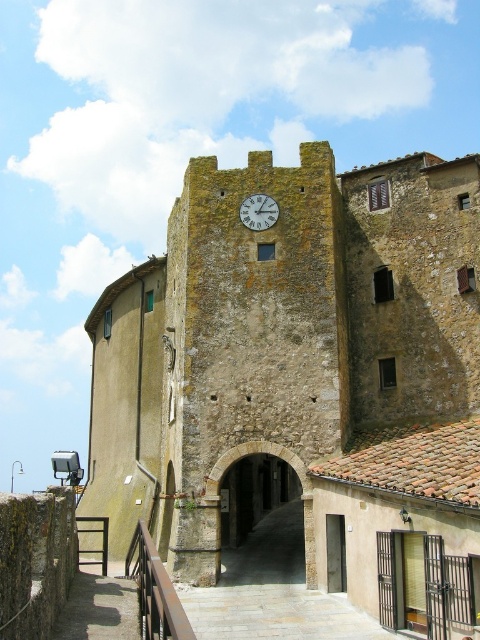
Does brown stone clock tower at center have a larger size compared to green stone clock at center?

Yes, brown stone clock tower at center is bigger than green stone clock at center.

Describe the element at coordinates (303, 380) in the screenshot. The height and width of the screenshot is (640, 480). I see `brown stone clock tower at center` at that location.

Is point (275, 179) positioned behind point (245, 218)?

Yes, it is.

At what (x,y) coordinates should I click in order to perform the action: click on brown stone clock tower at center. Please return your answer as a coordinate pair (x, y). The width and height of the screenshot is (480, 640). Looking at the image, I should click on (303, 380).

Is brown metal/rail at lower left shorter than green stone clock at center?

No, brown metal/rail at lower left is not shorter than green stone clock at center.

Between brown metal/rail at lower left and green stone clock at center, which one is positioned lower?

brown metal/rail at lower left is lower down.

Is point (173, 616) positioned after point (254, 202)?

No, it is in front of (254, 202).

Find the location of `brown metal/rail at lower left`. brown metal/rail at lower left is located at coordinates (155, 589).

Between point (266, 465) and point (177, 611), which one is positioned behind?

Positioned behind is point (266, 465).

Between brown stone clock tower at center and brown metal/rail at lower left, which one appears on the left side from the viewer's perspective?

Positioned to the left is brown metal/rail at lower left.

Who is more distant from viewer, [230,536] or [149,595]?

The point [230,536] is behind.

Identify the location of brown stone clock tower at center. Image resolution: width=480 pixels, height=640 pixels. (303, 380).